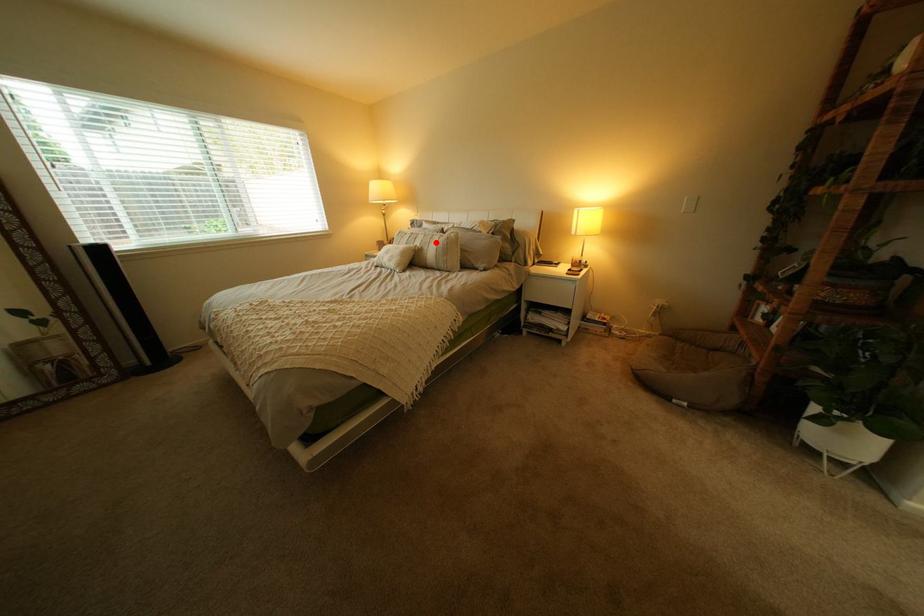
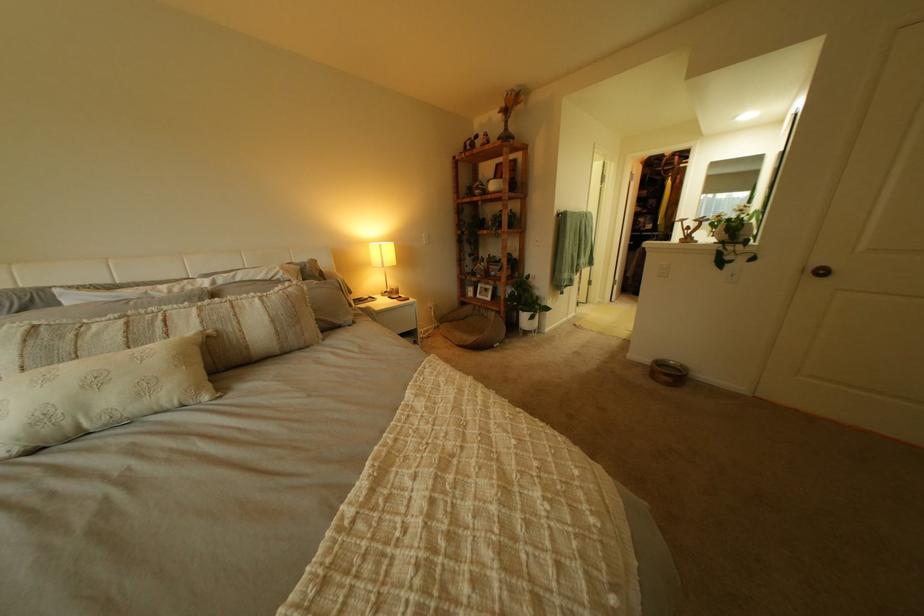
Where in the second image is the point corresponding to the highlighted location from the first image?

(213, 323)